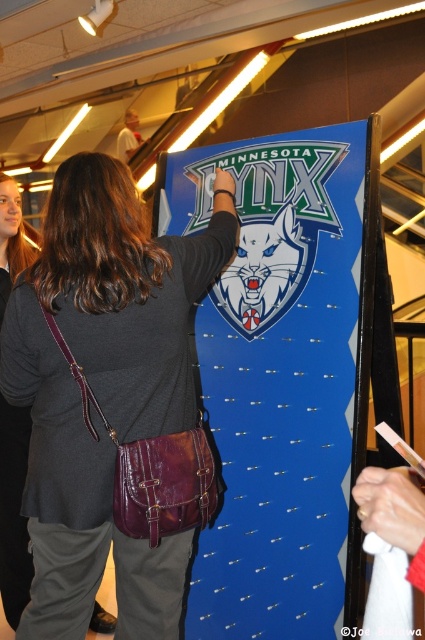
You are a photographer trying to capture the Minnesota Lynx dartboard in the center of your frame. You notice a blue glossy poster at center and a leather crossbody bag at center are blocking the view. Which object should you move to get a clear shot of the dartboard?

The blue glossy poster at center is wider than the leather crossbody bag at center, so you should move the blue glossy poster at center first to get a clear shot of the dartboard.

You are standing in front of the Minnesota Lynx dartboard and see two points marked on it. The points are labeled as point 1 at coordinates point (306, 604) and point 2 at coordinates point (54, 604). Which point is closer to the bottom edge of the dartboard?

Point 2 at coordinates point (54, 604) is closer to the bottom edge of the dartboard because its y coordinate is lower than point 1 at coordinates point (306, 604).

You are standing in a room where a person is holding a leather crossbody bag at center and there is a blue glossy poster at center. From your perspective, which object is located to the right of the other?

The blue glossy poster at center is positioned on the right side of leather crossbody bag at center.